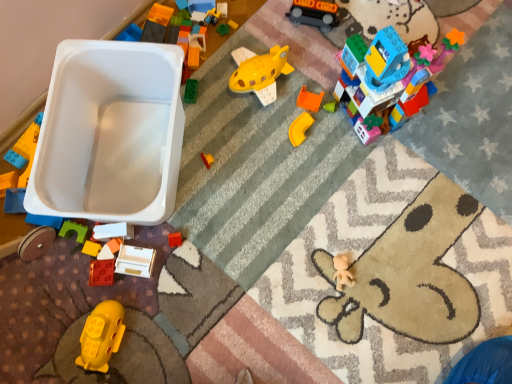
This screenshot has height=384, width=512. I want to click on free space between yellow matte plastic corner piece at center-right, positioned as the third toy in top-to-bottom order, and rubberized orange block at lower left, positioned as the eighth toy in right-to-left order, so click(227, 175).